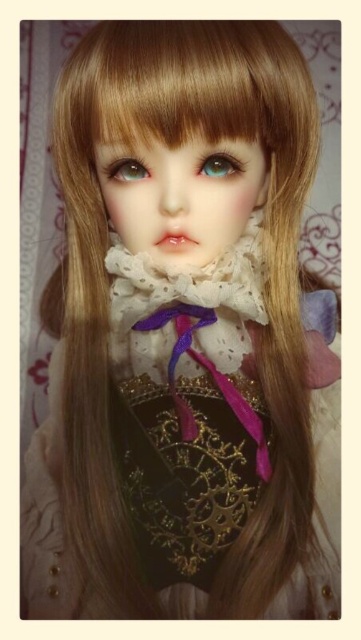
Question: Is teal glossy eye at center positioned before green matte eye at center?

Choices:
 (A) no
 (B) yes

Answer: (B)

Question: Is teal glossy eye at center above green matte eye at center?

Choices:
 (A) yes
 (B) no

Answer: (A)

Question: Does teal glossy eye at center appear under green matte eye at center?

Choices:
 (A) yes
 (B) no

Answer: (B)